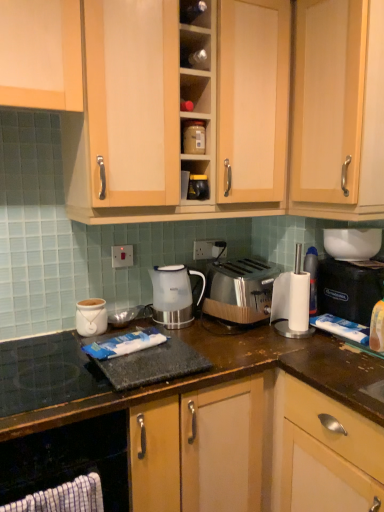
Locate an element on the screen. This screenshot has width=384, height=512. vacant space situated on the left part of white ceramic jar at center, the 1th appliance when ordered from bottom to top is located at coordinates (44, 338).